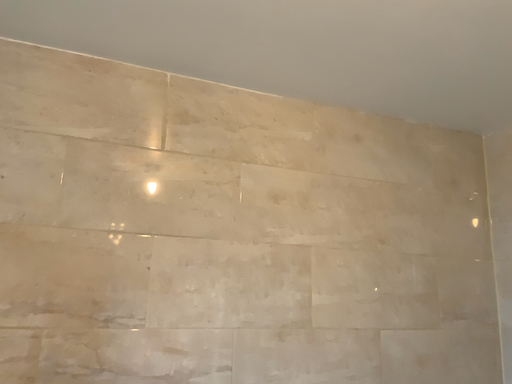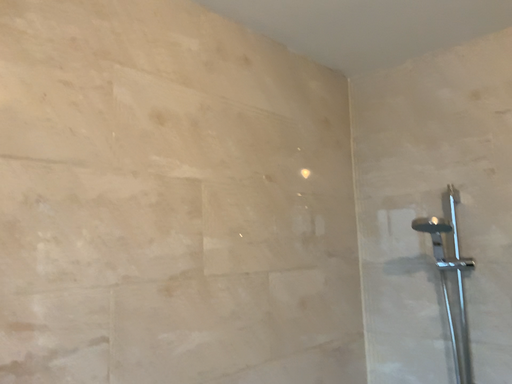
Question: Which way did the camera rotate in the video?

Choices:
 (A) rotated left
 (B) rotated right

Answer: (B)